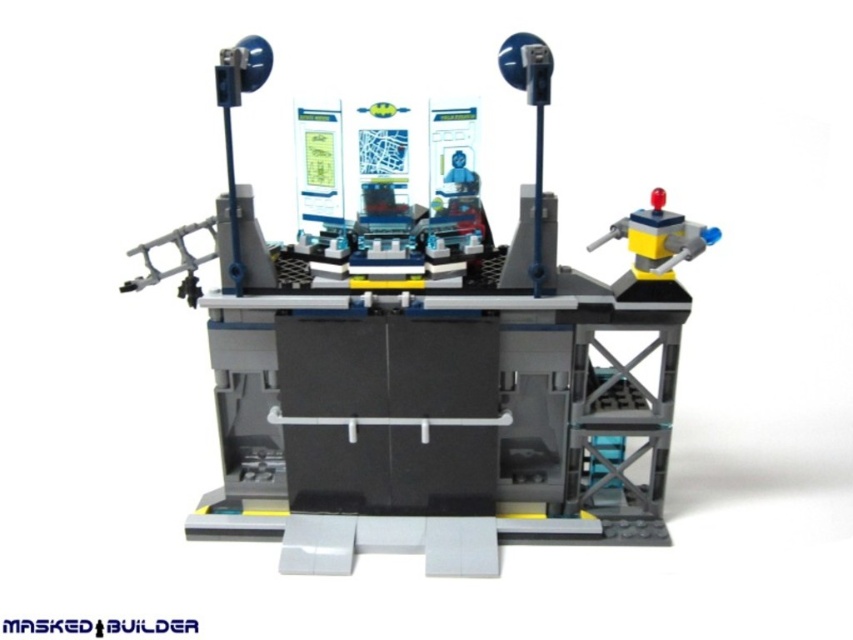
In the scene shown: You are a delivery drone that needs to drop a package between the matte gray robot at upper right and the yellow plastic robot at upper right. The package requires a 10 inch space to land safely. Can you fit the package between them?

The matte gray robot at upper right and yellow plastic robot at upper right are 9.41 inches apart. Since the required space is 10 inches, the package cannot fit between them.

In the LEGO control center scene, there are two robots at the upper right corner. Which robot is placed higher up between the matte gray robot at upper right and the yellow plastic robot at upper right?

The yellow plastic robot at upper right is placed higher up because the matte gray robot at upper right is positioned under it.